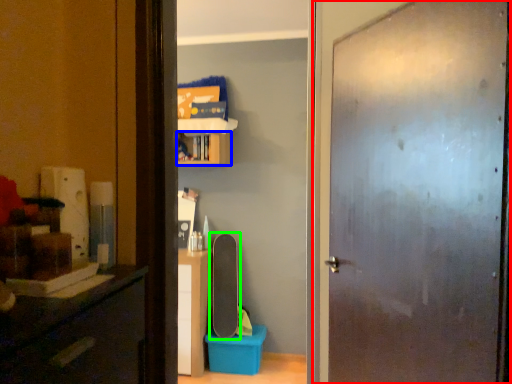
Question: Which object is the farthest from door (highlighted by a red box)? Choose among these: cabinet (highlighted by a blue box) or skateboard (highlighted by a green box).

Choices:
 (A) cabinet
 (B) skateboard

Answer: (B)